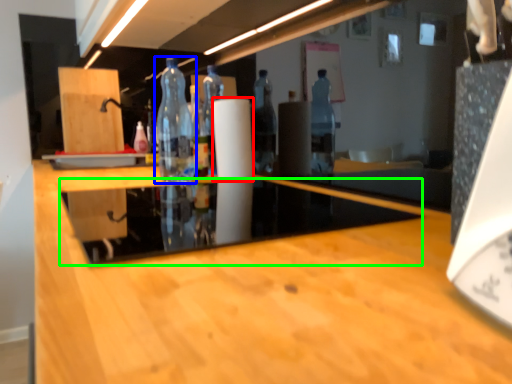
Question: Considering the real-world distances, which object is farthest from paper towel (highlighted by a red box)? bottle (highlighted by a blue box) or glass table (highlighted by a green box)?

Choices:
 (A) bottle
 (B) glass table

Answer: (B)